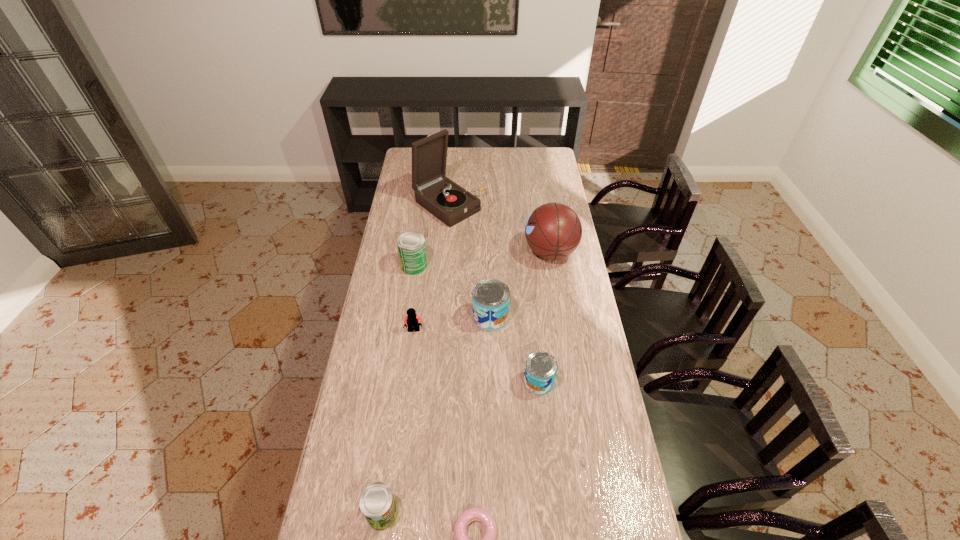
Where is `vacant region between the farthest object and the third can from left to right`? The width and height of the screenshot is (960, 540). vacant region between the farthest object and the third can from left to right is located at coordinates 469,261.

The width and height of the screenshot is (960, 540). In order to click on free space between the Lego and the second farthest can in this screenshot , I will do `click(452, 324)`.

The height and width of the screenshot is (540, 960). What are the coordinates of `empty space between the second tallest object and the third farthest can` in the screenshot? It's located at (544, 317).

Identify the location of object that is the third closest to the bigger green can. The width and height of the screenshot is (960, 540). (412, 320).

The height and width of the screenshot is (540, 960). Find the location of `the second closest object to the basketball`. the second closest object to the basketball is located at coordinates (490, 297).

Locate which can is the third closest to the nearer green can. Please provide its 2D coordinates. Your answer should be formatted as a tuple, i.e. [(x, y)], where the tuple contains the x and y coordinates of a point satisfying the conditions above.

[(411, 245)]

Identify which can is located as the fourth nearest to the tallest object. Please provide its 2D coordinates. Your answer should be formatted as a tuple, i.e. [(x, y)], where the tuple contains the x and y coordinates of a point satisfying the conditions above.

[(377, 503)]

The height and width of the screenshot is (540, 960). In order to click on free region that satisfies the following two spatial constraints: 1. on the front-facing side of the black Lego; 2. on the right side of the rightmost can in this screenshot , I will do `click(408, 382)`.

I want to click on free space in the image that satisfies the following two spatial constraints: 1. on the back side of the nearest can; 2. on the right side of the farther blue can, so click(x=410, y=317).